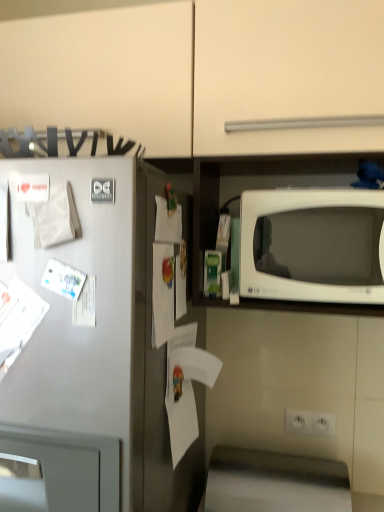
Image resolution: width=384 pixels, height=512 pixels. I want to click on white paper at center, the 4th paper when ordered from top to bottom, so click(186, 386).

Where is `satin silver refrigerator at left`? satin silver refrigerator at left is located at coordinates (103, 338).

Based on the photo, measure the distance between white glossy paper at left, which appears as the third paper when viewed from the top, and camera.

Answer: The depth of white glossy paper at left, which appears as the third paper when viewed from the top, is 30.87 inches.

Describe the element at coordinates (19, 322) in the screenshot. I see `white glossy paper at left, arranged as the second paper when ordered from the bottom` at that location.

What are the coordinates of `white plastic electric outlet at lower center` in the screenshot? It's located at (310, 422).

Would you say satin silver refrigerator at left is a long distance from white matte paper at left, the second paper viewed from the left?

No, there isn't a large distance between satin silver refrigerator at left and white matte paper at left, the second paper viewed from the left.

Does satin silver refrigerator at left appear on the right side of white matte paper at left, which ranks as the 2th paper in top-to-bottom order?

No.

Which of these two, satin silver refrigerator at left or white matte paper at left, the second paper viewed from the left, stands taller?

satin silver refrigerator at left is taller.

How different are the orientations of satin silver refrigerator at left and white matte paper at left, the second paper viewed from the left, in degrees?

satin silver refrigerator at left and white matte paper at left, the second paper viewed from the left, are facing 0.457 degrees away from each other.

In the scene shown: Who is taller, satin silver refrigerator at left or white plastic electric outlet at lower center?

Standing taller between the two is satin silver refrigerator at left.

From the image's perspective, would you say satin silver refrigerator at left is shown under white plastic electric outlet at lower center?

No, from the image's perspective, satin silver refrigerator at left is not beneath white plastic electric outlet at lower center.

From the picture: In terms of width, does satin silver refrigerator at left look wider or thinner when compared to white plastic electric outlet at lower center?

In the image, satin silver refrigerator at left appears to be wider than white plastic electric outlet at lower center.

Considering the sizes of objects satin silver refrigerator at left and white plastic electric outlet at lower center in the image provided, who is bigger, satin silver refrigerator at left or white plastic electric outlet at lower center?

With larger size is satin silver refrigerator at left.

Would you consider white plastic electric outlet at lower center to be distant from satin silver refrigerator at left?

No, there isn't a large distance between white plastic electric outlet at lower center and satin silver refrigerator at left.

Between white plastic electric outlet at lower center and satin silver refrigerator at left, which one has larger size?

With larger size is satin silver refrigerator at left.

Is white plastic electric outlet at lower center to the right of satin silver refrigerator at left from the viewer's perspective?

Yes.

Does white plastic electric outlet at lower center have a greater height compared to satin silver refrigerator at left?

No, white plastic electric outlet at lower center is not taller than satin silver refrigerator at left.

Would you say white matte paper at left, which ranks as the 2th paper in top-to-bottom order, is outside white paper at center, arranged as the first paper when viewed from the right?

Indeed, white matte paper at left, which ranks as the 2th paper in top-to-bottom order, is completely outside white paper at center, arranged as the first paper when viewed from the right.

Between white matte paper at left, which is the 3th paper from right to left, and white paper at center, arranged as the first paper when viewed from the right, which one appears on the right side from the viewer's perspective?

white paper at center, arranged as the first paper when viewed from the right, is more to the right.

Is white matte paper at left, which is the 3th paper from right to left, aimed at white paper at center, which ranks as the fourth paper in left-to-right order?

No, white matte paper at left, which is the 3th paper from right to left, is not aimed at white paper at center, which ranks as the fourth paper in left-to-right order.

Which of these two, white matte paper at left, which is the 3th paper from right to left, or white paper at center, which ranks as the fourth paper in left-to-right order, stands shorter?

Standing shorter between the two is white matte paper at left, which is the 3th paper from right to left.

Between point (269, 234) and point (288, 431), which one is positioned in front?

Positioned in front is point (269, 234).

Which object is positioned more to the left, white glossy microwave at right or white plastic electric outlet at lower center?

white glossy microwave at right.

I want to click on electric outlet behind the white glossy microwave at right, so click(310, 422).

Locate an element on the screen. Image resolution: width=384 pixels, height=512 pixels. microwave oven located above the satin silver refrigerator at left (from the image's perspective) is located at coordinates (312, 245).

Based on their sizes in the image, would you say satin silver refrigerator at left is bigger or smaller than white glossy microwave at right?

Considering their sizes, satin silver refrigerator at left takes up more space than white glossy microwave at right.

Are satin silver refrigerator at left and white glossy microwave at right located far from each other?

No, satin silver refrigerator at left is not far away from white glossy microwave at right.

From a real-world perspective, which object rests below the other?

In real-world perspective, satin silver refrigerator at left is lower.

Is white glossy microwave at right outside of white glossy paper at left, which appears as the third paper when viewed from the top?

Yes, white glossy microwave at right is located beyond the bounds of white glossy paper at left, which appears as the third paper when viewed from the top.

Are white glossy microwave at right and white glossy paper at left, placed as the 1th paper when sorted from left to right, far apart?

No, white glossy microwave at right is in close proximity to white glossy paper at left, placed as the 1th paper when sorted from left to right.

Considering the positions of objects white glossy microwave at right and white glossy paper at left, placed as the fourth paper when sorted from right to left, in the image provided, who is more to the right, white glossy microwave at right or white glossy paper at left, placed as the fourth paper when sorted from right to left,?

white glossy microwave at right is more to the right.

Can you confirm if white glossy microwave at right is smaller than white glossy paper at left, placed as the 1th paper when sorted from left to right?

No.

From the image's perspective, count 2nd papers upward from the satin silver refrigerator at left and point to it. Please provide its 2D coordinates.

[(55, 217)]

Locate an element on the screen. This screenshot has width=384, height=512. electric outlet behind the satin silver refrigerator at left is located at coordinates (310, 422).

When comparing their distances from white glossy paper at left, placed as the fourth paper when sorted from right to left, does satin silver refrigerator at left or white glossy microwave at right seem closer?

satin silver refrigerator at left is closer to white glossy paper at left, placed as the fourth paper when sorted from right to left.

Consider the image. Based on their spatial positions, is white glossy microwave at right or white plastic electric outlet at lower center further from white paper at center, the 4th paper when ordered from top to bottom?

The object further to white paper at center, the 4th paper when ordered from top to bottom, is white plastic electric outlet at lower center.

Based on their spatial positions, is white matte paper at center, the 2th paper viewed from the right, or satin silver refrigerator at left closer to white matte paper at left, which is the 3th paper from right to left?

The object closer to white matte paper at left, which is the 3th paper from right to left, is white matte paper at center, the 2th paper viewed from the right.

When comparing their distances from white plastic electric outlet at lower center, does satin silver refrigerator at left or white glossy microwave at right seem further?

satin silver refrigerator at left lies further to white plastic electric outlet at lower center than the other object.

Which object lies nearer to the anchor point white paper at center, which ranks as the fourth paper in left-to-right order, white glossy microwave at right or white matte paper at left, which is the 3th paper from right to left?

white glossy microwave at right.

Estimate the real-world distances between objects in this image. Which object is further from white plastic electric outlet at lower center, white glossy paper at left, placed as the 1th paper when sorted from left to right, or white glossy microwave at right?

white glossy paper at left, placed as the 1th paper when sorted from left to right, lies further to white plastic electric outlet at lower center than the other object.

Estimate the real-world distances between objects in this image. Which object is closer to satin silver refrigerator at left, white glossy microwave at right or white matte paper at left, the third paper ordered from the bottom?

white matte paper at left, the third paper ordered from the bottom, is positioned closer to the anchor satin silver refrigerator at left.

From the picture: When comparing their distances from satin silver refrigerator at left, does white plastic electric outlet at lower center or white glossy paper at left, placed as the fourth paper when sorted from right to left, seem further?

Among the two, white plastic electric outlet at lower center is located further to satin silver refrigerator at left.

Find the location of a particular element. microwave oven between satin silver refrigerator at left and white plastic electric outlet at lower center in the horizontal direction is located at coordinates (312, 245).

I want to click on paper between white matte paper at left, the third paper ordered from the bottom, and white paper at center, the first paper when ordered from bottom to top, in the up-down direction, so click(x=19, y=322).

Locate an element on the screen. This screenshot has width=384, height=512. microwave oven between white matte paper at center, arranged as the third paper when viewed from the left, and white plastic electric outlet at lower center from top to bottom is located at coordinates (312, 245).

Locate an element on the screen. refrigerator between white matte paper at left, the third paper ordered from the bottom, and white paper at center, which ranks as the fourth paper in left-to-right order, in the vertical direction is located at coordinates [103, 338].